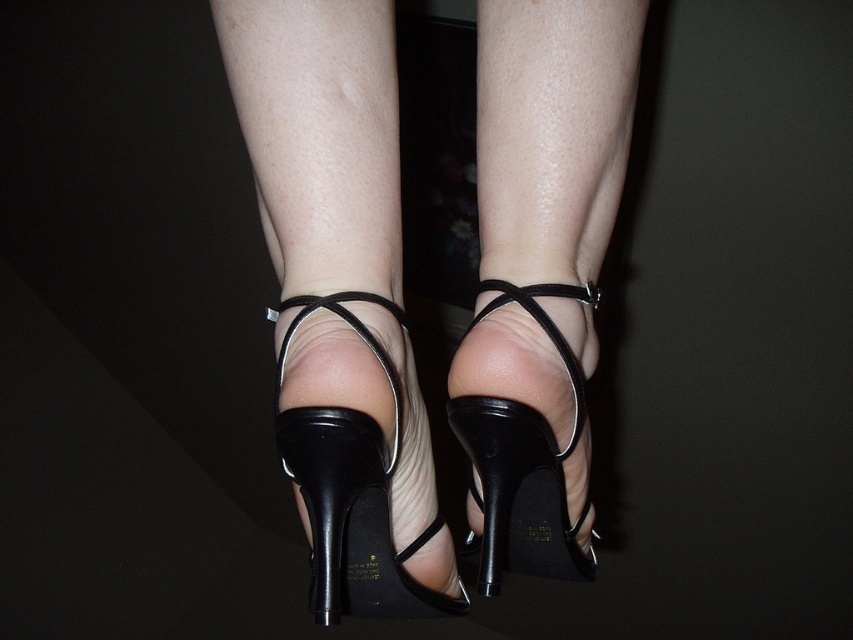
Which is more to the right, black matte sandal at center or black leather high-heeled shoe at center?

black leather high-heeled shoe at center is more to the right.

Who is more distant from viewer, (383, 499) or (531, 554)?

Point (531, 554)

Locate an element on the screen. This screenshot has width=853, height=640. black matte sandal at center is located at coordinates (352, 490).

Which is more to the left, black leather heels at center or black matte sandal at center?

black matte sandal at center is more to the left.

This screenshot has height=640, width=853. Describe the element at coordinates (340, 300) in the screenshot. I see `black leather heels at center` at that location.

The image size is (853, 640). What are the coordinates of `black leather heels at center` in the screenshot? It's located at (340, 300).

Is black leather heels at center in front of black leather high-heeled shoe at center?

Yes, it is.

Does point (303, 28) come in front of point (538, 451)?

Yes.

Where is `black leather heels at center`? black leather heels at center is located at coordinates (340, 300).